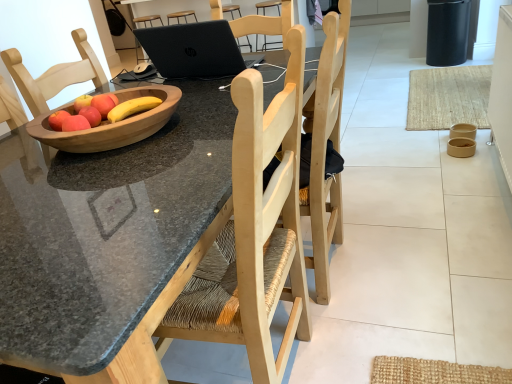
Where is `free space behind brown paper bowl at lower right, which ranks as the second bowl in right-to-left order`? This screenshot has height=384, width=512. free space behind brown paper bowl at lower right, which ranks as the second bowl in right-to-left order is located at coordinates (434, 142).